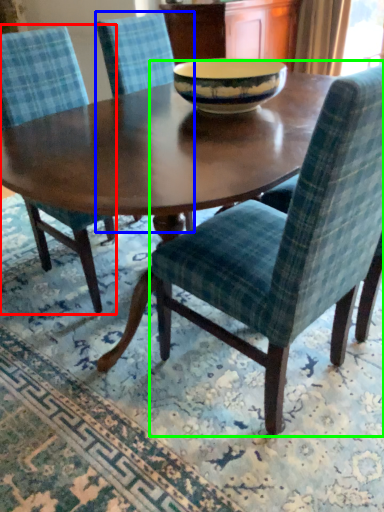
Question: Which object is the farthest from chair (highlighted by a red box)? Choose among these: chair (highlighted by a blue box) or chair (highlighted by a green box).

Choices:
 (A) chair
 (B) chair

Answer: (A)